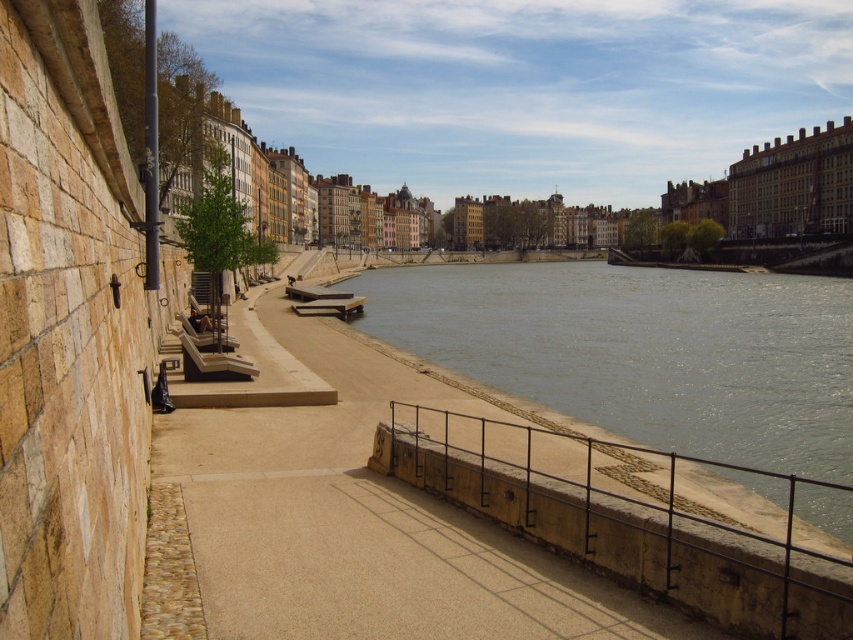
Question: Which object is the farthest from the brown wooden bench at center?

Choices:
 (A) wooden park bench at center-left
 (B) smooth concrete path at center

Answer: (B)

Question: Can you confirm if wooden park bench at center is positioned below wooden park bench at center-left?

Choices:
 (A) yes
 (B) no

Answer: (B)

Question: Which point is closer to the camera taking this photo?

Choices:
 (A) click(x=743, y=310)
 (B) click(x=212, y=321)
 (C) click(x=318, y=304)

Answer: (B)

Question: Is smooth concrete path at center to the left of wooden park bench at center from the viewer's perspective?

Choices:
 (A) yes
 (B) no

Answer: (B)

Question: Among these points, which one is nearest to the camera?

Choices:
 (A) (213, 308)
 (B) (338, 308)

Answer: (A)

Question: Is smooth concrete path at center positioned before smooth concrete river at center?

Choices:
 (A) no
 (B) yes

Answer: (B)